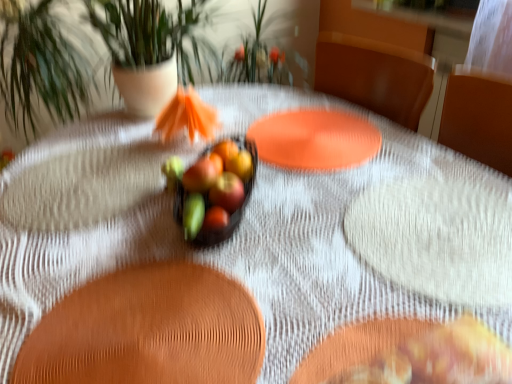
Question: Can we say glossy red apple at center, the second apple in the back-to-front sequence, lies outside glossy glass bowl at center, the 3th fruit when ordered from bottom to top?

Choices:
 (A) no
 (B) yes

Answer: (B)

Question: Is glossy red apple at center, the second apple in the back-to-front sequence, aimed at glossy glass bowl at center, the first fruit from the back?

Choices:
 (A) yes
 (B) no

Answer: (B)

Question: Does glossy red apple at center, the second apple in the back-to-front sequence, lie behind glossy glass bowl at center, the third fruit from the front?

Choices:
 (A) no
 (B) yes

Answer: (A)

Question: From the image's perspective, is glossy red apple at center, the first apple in the front-to-back sequence, above glossy glass bowl at center, the third fruit from the front?

Choices:
 (A) no
 (B) yes

Answer: (A)

Question: Can you confirm if glossy red apple at center, the second apple in the back-to-front sequence, is positioned to the left of glossy glass bowl at center, which appears as the 1th fruit when viewed from the right?

Choices:
 (A) no
 (B) yes

Answer: (A)

Question: Can you confirm if glossy red apple at center, the first apple in the front-to-back sequence, is smaller than glossy glass bowl at center, the first fruit from the top?

Choices:
 (A) yes
 (B) no

Answer: (B)

Question: From a real-world perspective, is green leafy plant at center positioned under glossy glass bowl at center, which appears as the 1th fruit when viewed from the right, based on gravity?

Choices:
 (A) yes
 (B) no

Answer: (B)

Question: From the image's perspective, does green leafy plant at center appear higher than glossy glass bowl at center, the third fruit from the front?

Choices:
 (A) no
 (B) yes

Answer: (B)

Question: Does green leafy plant at center have a lesser width compared to glossy glass bowl at center, which ranks as the third fruit in left-to-right order?

Choices:
 (A) no
 (B) yes

Answer: (A)

Question: Considering the relative sizes of green leafy plant at center and glossy glass bowl at center, the third fruit from the front, in the image provided, is green leafy plant at center shorter than glossy glass bowl at center, the third fruit from the front,?

Choices:
 (A) yes
 (B) no

Answer: (B)

Question: Would you say glossy glass bowl at center, which ranks as the third fruit in left-to-right order, is part of green leafy plant at center's contents?

Choices:
 (A) no
 (B) yes

Answer: (A)

Question: Considering the relative positions of green leafy plant at center and glossy glass bowl at center, which ranks as the third fruit in left-to-right order, in the image provided, is green leafy plant at center in front of glossy glass bowl at center, which ranks as the third fruit in left-to-right order,?

Choices:
 (A) yes
 (B) no

Answer: (A)

Question: From the image's perspective, is glossy apple at center, arranged as the second apple when viewed from the front, beneath green matte flower at center?

Choices:
 (A) no
 (B) yes

Answer: (A)